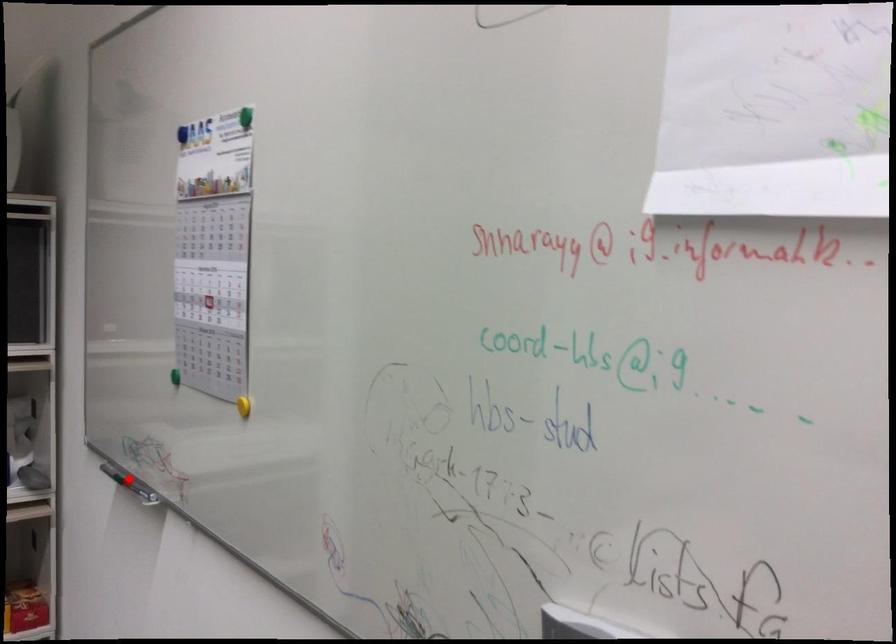
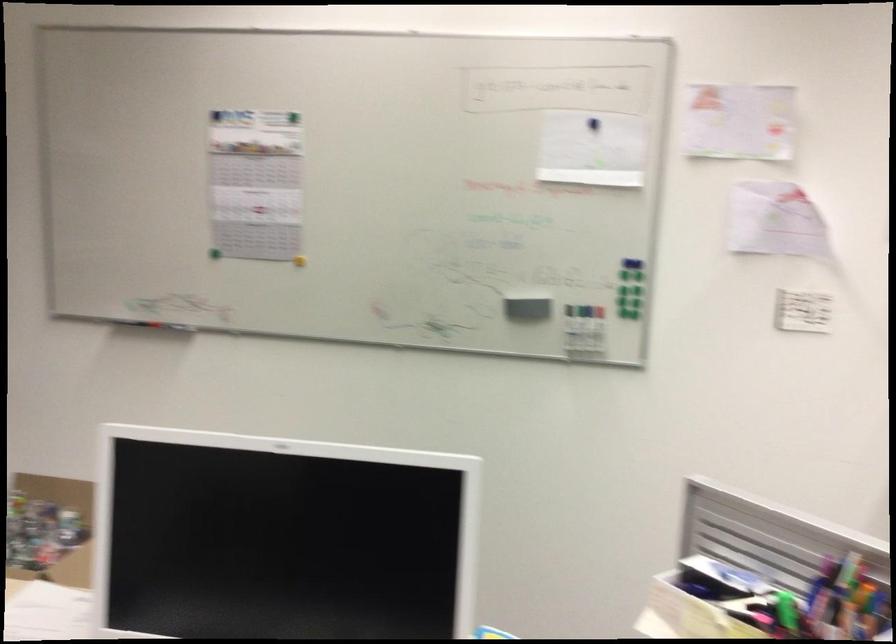
Find the pixel in the second image that matches the highlighted location in the first image.

(158, 325)